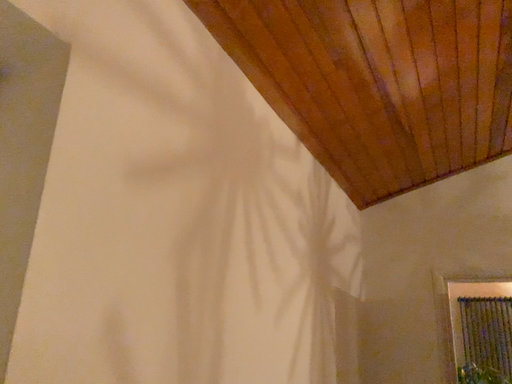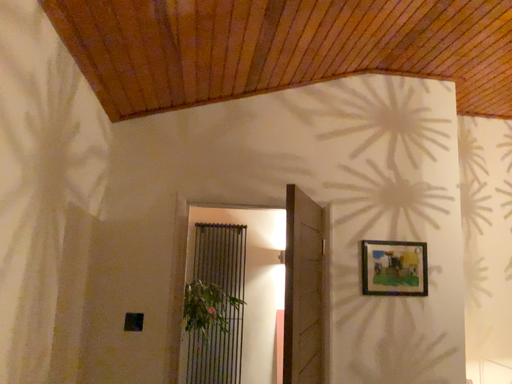
Question: How did the camera likely rotate when shooting the video?

Choices:
 (A) rotated left
 (B) rotated right

Answer: (B)